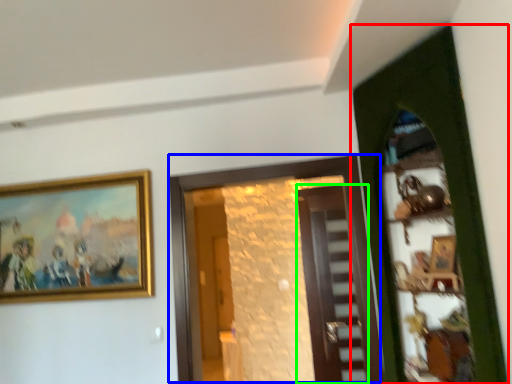
Question: Which object is positioned closest to door (highlighted by a red box)? Select from door (highlighted by a blue box) and door (highlighted by a green box).

Choices:
 (A) door
 (B) door

Answer: (A)